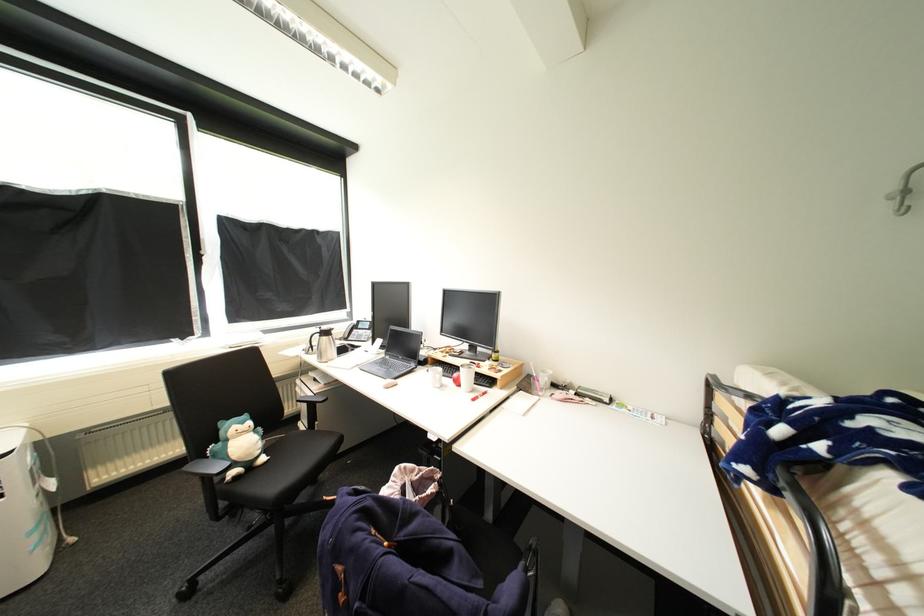
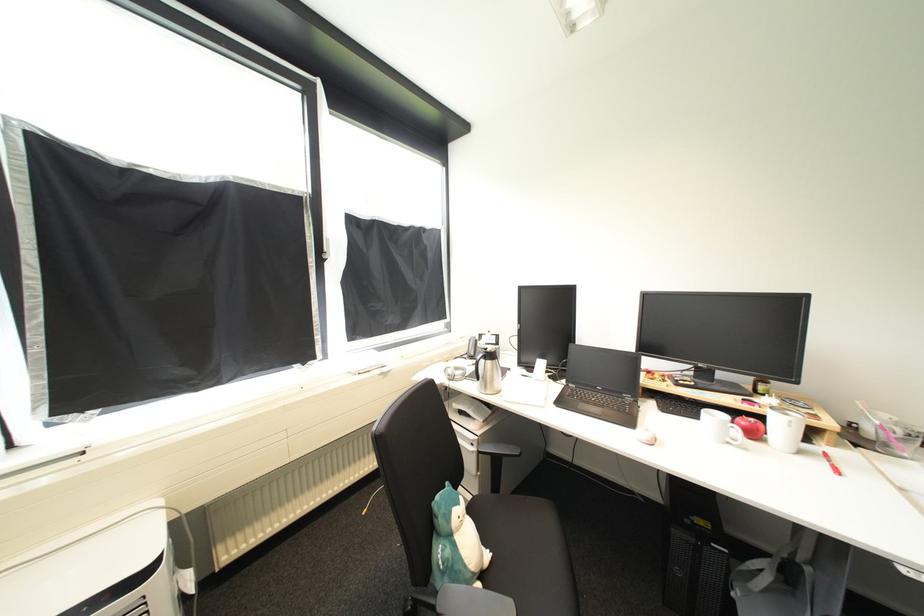
Locate, in the second image, the point that corresponds to the point at 209,254 in the first image.

(331, 257)